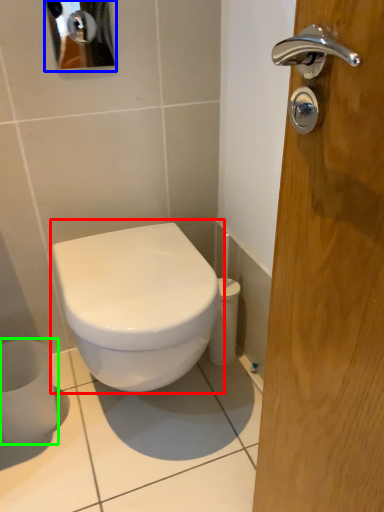
Question: Which is farther away from toilet (highlighted by a red box)? mirror (highlighted by a blue box) or toilet paper (highlighted by a green box)?

Choices:
 (A) mirror
 (B) toilet paper

Answer: (A)